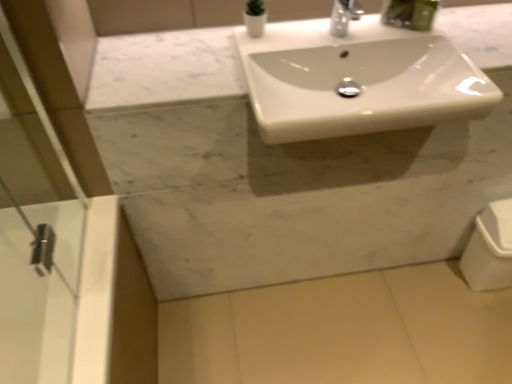
Question: Is white glossy vase at upper center smaller than white glossy trash can at lower right?

Choices:
 (A) no
 (B) yes

Answer: (B)

Question: Is white glossy vase at upper center in front of white glossy trash can at lower right?

Choices:
 (A) no
 (B) yes

Answer: (B)

Question: From a real-world perspective, does white glossy vase at upper center stand above white glossy trash can at lower right?

Choices:
 (A) no
 (B) yes

Answer: (B)

Question: Is white glossy vase at upper center further to camera compared to white glossy trash can at lower right?

Choices:
 (A) yes
 (B) no

Answer: (B)

Question: Does white glossy vase at upper center have a greater width compared to white glossy trash can at lower right?

Choices:
 (A) no
 (B) yes

Answer: (A)

Question: Choose the correct answer: Is white glossy vase at upper center inside white glossy sink at center or outside it?

Choices:
 (A) outside
 (B) inside

Answer: (A)

Question: Looking at their shapes, would you say white glossy vase at upper center is wider or thinner than white glossy sink at center?

Choices:
 (A) thin
 (B) wide

Answer: (A)

Question: From a real-world perspective, is white glossy vase at upper center above or below white glossy sink at center?

Choices:
 (A) below
 (B) above

Answer: (B)

Question: From the image's perspective, is white glossy vase at upper center above or below white glossy sink at center?

Choices:
 (A) below
 (B) above

Answer: (B)

Question: Which is correct: white glossy trash can at lower right is inside white glossy vase at upper center, or outside of it?

Choices:
 (A) inside
 (B) outside

Answer: (B)

Question: In terms of width, does white glossy trash can at lower right look wider or thinner when compared to white glossy vase at upper center?

Choices:
 (A) wide
 (B) thin

Answer: (A)

Question: Is white glossy trash can at lower right taller or shorter than white glossy vase at upper center?

Choices:
 (A) short
 (B) tall

Answer: (B)

Question: From a real-world perspective, is white glossy trash can at lower right above or below white glossy vase at upper center?

Choices:
 (A) below
 (B) above

Answer: (A)

Question: From the image's perspective, is white glossy sink at center above or below white glossy trash can at lower right?

Choices:
 (A) below
 (B) above

Answer: (B)

Question: From a real-world perspective, is white glossy sink at center physically located above or below white glossy trash can at lower right?

Choices:
 (A) above
 (B) below

Answer: (A)